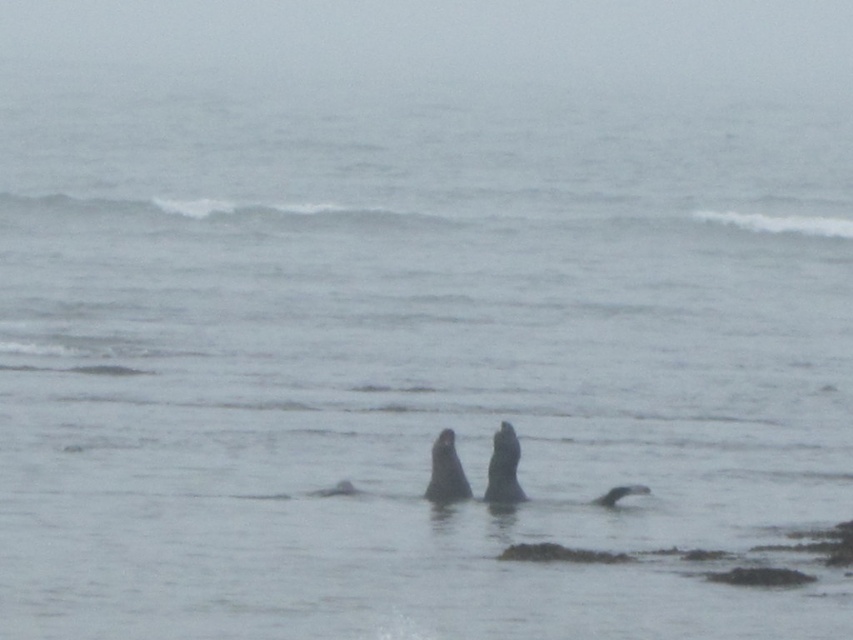
You are a wildlife photographer aiming to capture a closeup shot of the seals. You are currently positioned at the edge of the cliff overlooking the ocean. Which seal, the dark gray fur seal at center or the dark gray fur seal at lower center, is positioned closer to you?

The dark gray fur seal at center is closer to the viewer than the dark gray fur seal at lower center, so you should focus on capturing the dark gray fur seal at center for a closer shot.

You are standing on the beach and see the gray matte seal at center and the dark gray fur seal at lower center. Which seal is closer to you?

The gray matte seal at center is closer to the viewer than the dark gray fur seal at lower center.